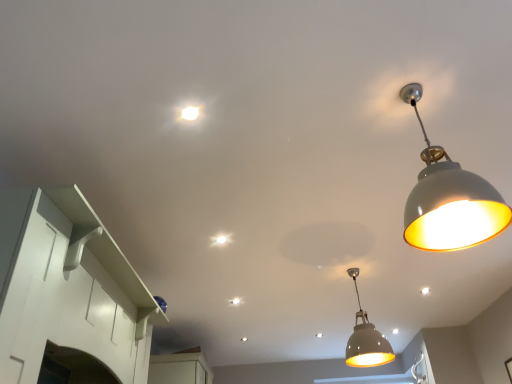
Question: Is matte white pendant light at center, the first lamp in the bottom-to-top sequence, spatially inside white glossy light bulb at upper center, or outside of it?

Choices:
 (A) outside
 (B) inside

Answer: (A)

Question: From their relative heights in the image, would you say matte white pendant light at center, the first lamp positioned from the back, is taller or shorter than white glossy light bulb at upper center?

Choices:
 (A) tall
 (B) short

Answer: (A)

Question: Considering the real-world distances, which object is farthest from the white glossy pendant light at upper right, which is counted as the first lamp, starting from the top?

Choices:
 (A) matte white pendant light at center, the first lamp in the bottom-to-top sequence
 (B) white glossy light bulb at upper center
 (C) white glossy cabinet at left

Answer: (C)

Question: Estimate the real-world distances between objects in this image. Which object is farther from the white glossy light bulb at upper center?

Choices:
 (A) matte white pendant light at center, the first lamp in the bottom-to-top sequence
 (B) white glossy cabinet at left
 (C) white glossy pendant light at upper right, which is counted as the first lamp, starting from the top

Answer: (A)